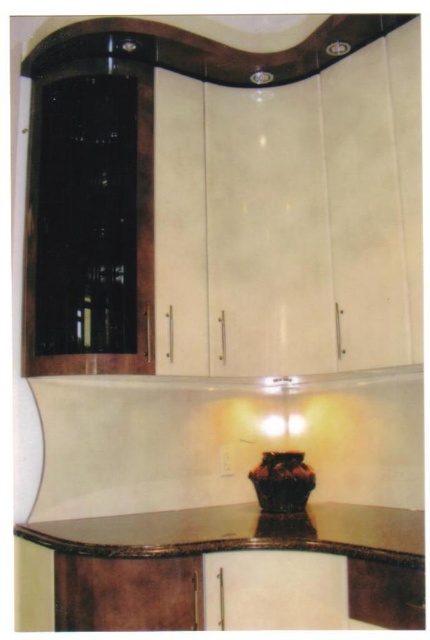
Question: Is brown marble countertop at center to the right of brown glossy vase at center from the viewer's perspective?

Choices:
 (A) yes
 (B) no

Answer: (B)

Question: In this image, where is brown marble countertop at center located relative to brown glossy vase at center?

Choices:
 (A) left
 (B) right

Answer: (A)

Question: Considering the relative positions of brown marble countertop at center and brown glossy vase at center in the image provided, where is brown marble countertop at center located with respect to brown glossy vase at center?

Choices:
 (A) above
 (B) below

Answer: (B)